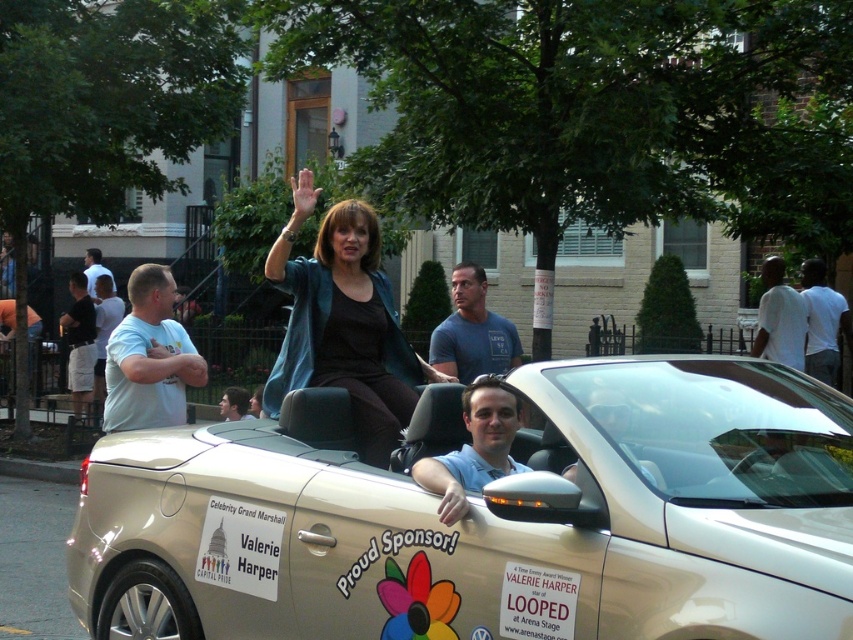
Is gold metallic convertible at center bigger than matte blue jacket at center?

Yes, gold metallic convertible at center is bigger than matte blue jacket at center.

Is gold metallic convertible at center to the right of matte blue jacket at center from the viewer's perspective?

Yes, gold metallic convertible at center is to the right of matte blue jacket at center.

Is point (372, 529) less distant than point (320, 310)?

That is True.

At what (x,y) coordinates should I click in order to perform the action: click on gold metallic convertible at center. Please return your answer as a coordinate pair (x, y). Looking at the image, I should click on (488, 516).